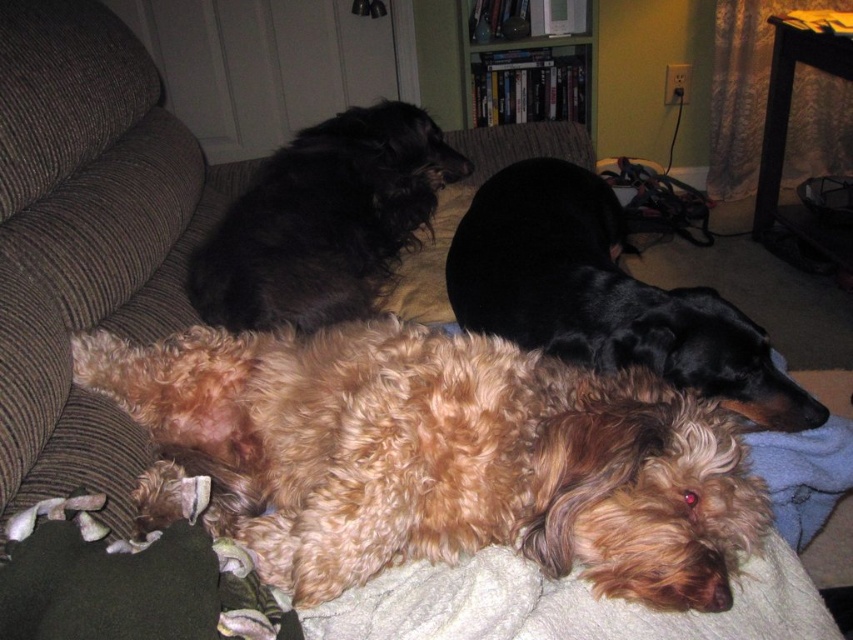
Question: Can you confirm if brown fabric couch at center is bigger than black silky dog at center?

Choices:
 (A) no
 (B) yes

Answer: (B)

Question: Among these points, which one is nearest to the camera?

Choices:
 (A) (263, 289)
 (B) (515, 340)
 (C) (149, 208)

Answer: (B)

Question: Which point appears closest to the camera in this image?

Choices:
 (A) (138, 387)
 (B) (798, 428)
 (C) (32, 364)
 (D) (445, 307)

Answer: (C)

Question: Can you confirm if shiny black fur at upper left is smaller than black fabric pillow at upper center?

Choices:
 (A) yes
 (B) no

Answer: (B)

Question: Which object is the farthest from the shiny black fur at upper left?

Choices:
 (A) fuzzy brown dog at center
 (B) brown fabric couch at center
 (C) black silky dog at center

Answer: (A)

Question: Considering the relative positions of fuzzy brown dog at center and shiny black fur at upper left in the image provided, where is fuzzy brown dog at center located with respect to shiny black fur at upper left?

Choices:
 (A) right
 (B) left

Answer: (A)